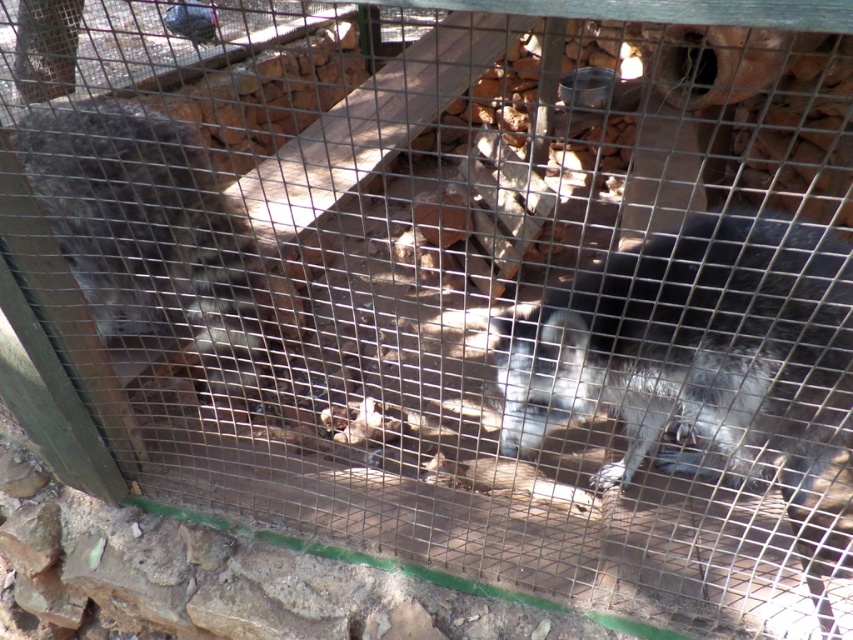
Consider the image. Who is lower down, gray fur monkey at center or gray furry animal at left?

gray fur monkey at center is below.

Can you confirm if gray fur monkey at center is positioned to the left of gray furry animal at left?

Incorrect, gray fur monkey at center is not on the left side of gray furry animal at left.

Consider the image. Measure the distance between gray fur monkey at center and camera.

A distance of 1.46 meters exists between gray fur monkey at center and camera.

In order to click on gray fur monkey at center in this screenshot , I will do `click(695, 349)`.